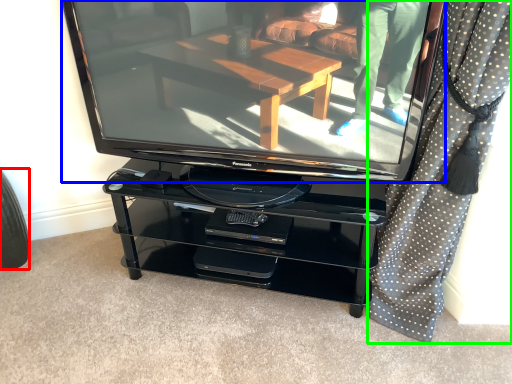
Question: Based on their relative distances, which object is farther from tire (highlighted by a red box)? Choose from television (highlighted by a blue box) and curtain (highlighted by a green box).

Choices:
 (A) television
 (B) curtain

Answer: (B)